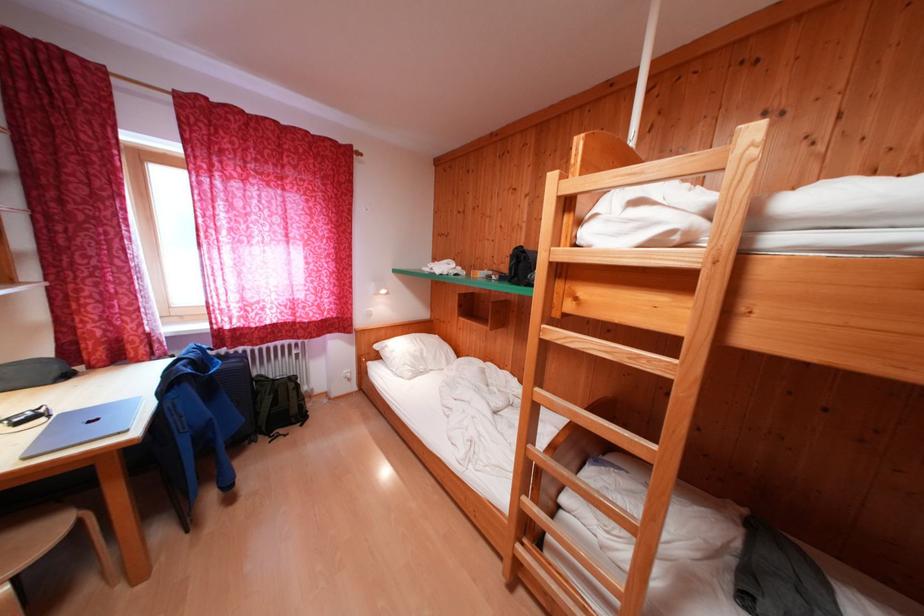
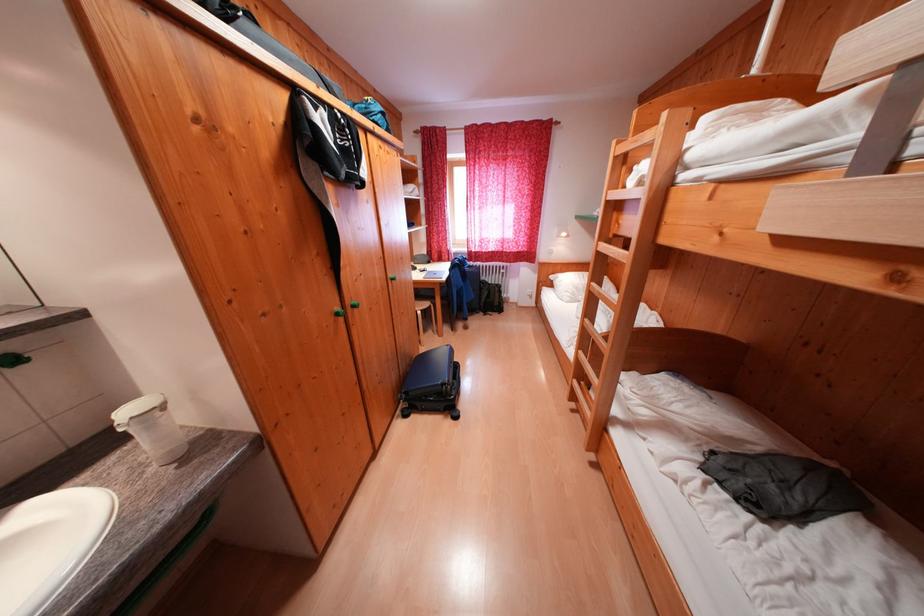
The point at (171, 397) is marked in the first image. Where is the corresponding point in the second image?

(458, 274)